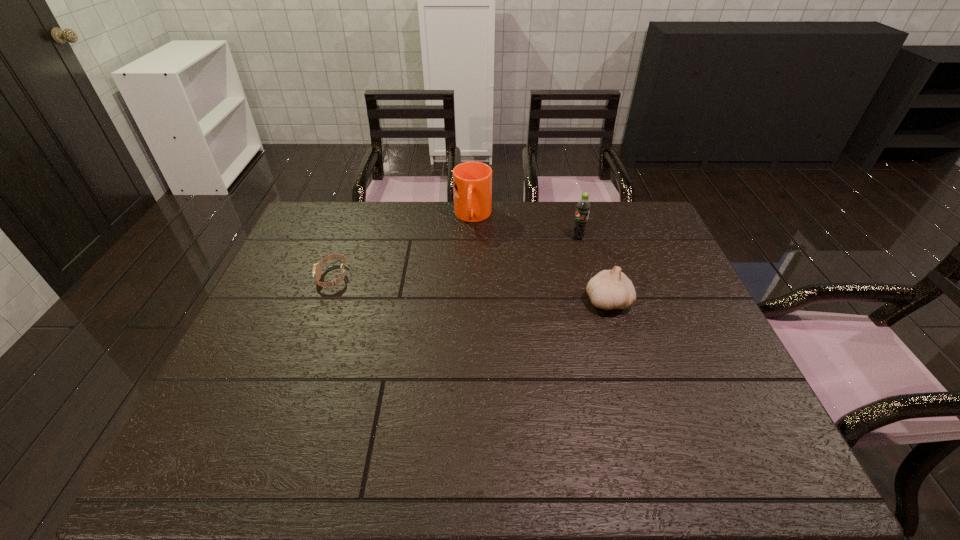
Locate an element on the screen. Image resolution: width=960 pixels, height=540 pixels. vacant space situated on the front label of the third nearest object is located at coordinates (547, 248).

Find the location of `vacant space located on the handle side of the third object from right to left`. vacant space located on the handle side of the third object from right to left is located at coordinates pyautogui.click(x=468, y=309).

Where is `blank space located 0.390m on the handle side of the third object from right to left`? blank space located 0.390m on the handle side of the third object from right to left is located at coordinates (468, 320).

At what (x,y) coordinates should I click in order to perform the action: click on free space located 0.350m on the handle side of the third object from right to left. Please return your answer as a coordinate pair (x, y). Looking at the image, I should click on (468, 309).

Image resolution: width=960 pixels, height=540 pixels. In order to click on soda at the far edge in this screenshot , I will do `click(583, 207)`.

Where is `mug that is at the far edge`? Image resolution: width=960 pixels, height=540 pixels. mug that is at the far edge is located at coordinates (472, 181).

You are a GUI agent. You are given a task and a screenshot of the screen. Output one action in this format:
    pyautogui.click(x=<x>, y=<y>)
    Task: Click on the object at the left edge
    Image resolution: width=960 pixels, height=540 pixels.
    Given the screenshot: What is the action you would take?
    pyautogui.click(x=316, y=271)

The height and width of the screenshot is (540, 960). In the image, there is a desktop. Find the location of `free space at the far edge`. free space at the far edge is located at coordinates (599, 237).

At what (x,y) coordinates should I click in order to perform the action: click on free space at the near edge of the desktop. Please return your answer as a coordinate pair (x, y). The width and height of the screenshot is (960, 540). Looking at the image, I should click on (625, 408).

You are a GUI agent. You are given a task and a screenshot of the screen. Output one action in this format:
    pyautogui.click(x=<x>, y=<y>)
    Task: Click on the free spot at the left edge of the desktop
    
    Given the screenshot: What is the action you would take?
    pyautogui.click(x=284, y=379)